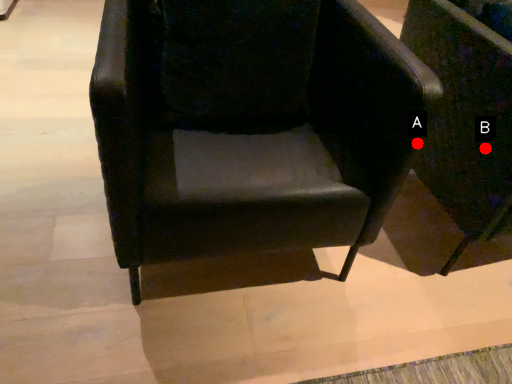
Question: Two points are circled on the image, labeled by A and B beside each circle. Which point is farther from the camera taking this photo?

Choices:
 (A) A is further
 (B) B is further

Answer: (B)